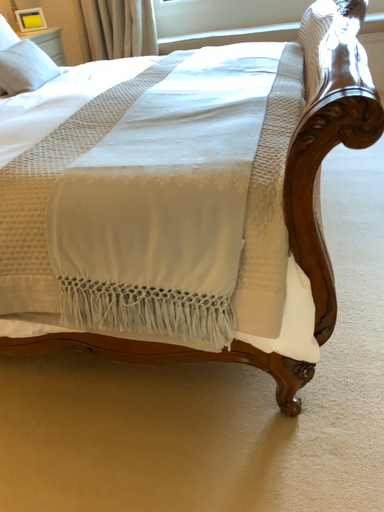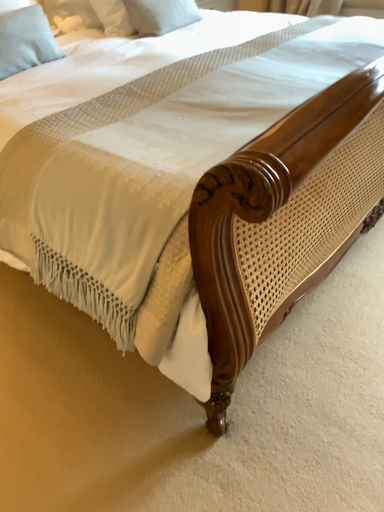
Question: How did the camera likely rotate when shooting the video?

Choices:
 (A) rotated right
 (B) rotated left

Answer: (B)